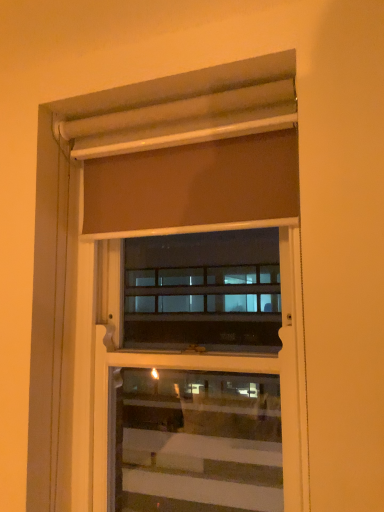
Question: Is matte brown roller shade at upper center spatially inside matte brown curtain at upper center, or outside of it?

Choices:
 (A) inside
 (B) outside

Answer: (B)

Question: In terms of width, does matte brown roller shade at upper center look wider or thinner when compared to matte brown curtain at upper center?

Choices:
 (A) wide
 (B) thin

Answer: (B)

Question: Considering the relative positions of matte brown roller shade at upper center and matte brown curtain at upper center in the image provided, is matte brown roller shade at upper center to the left or to the right of matte brown curtain at upper center?

Choices:
 (A) left
 (B) right

Answer: (B)

Question: Considering the positions of matte brown curtain at upper center and matte brown roller shade at upper center in the image, is matte brown curtain at upper center wider or thinner than matte brown roller shade at upper center?

Choices:
 (A) wide
 (B) thin

Answer: (A)

Question: Is matte brown curtain at upper center inside the boundaries of matte brown roller shade at upper center, or outside?

Choices:
 (A) inside
 (B) outside

Answer: (B)

Question: Relative to matte brown roller shade at upper center, is matte brown curtain at upper center in front or behind?

Choices:
 (A) behind
 (B) front

Answer: (B)

Question: Does point (230, 159) appear closer or farther from the camera than point (210, 354)?

Choices:
 (A) closer
 (B) farther

Answer: (A)